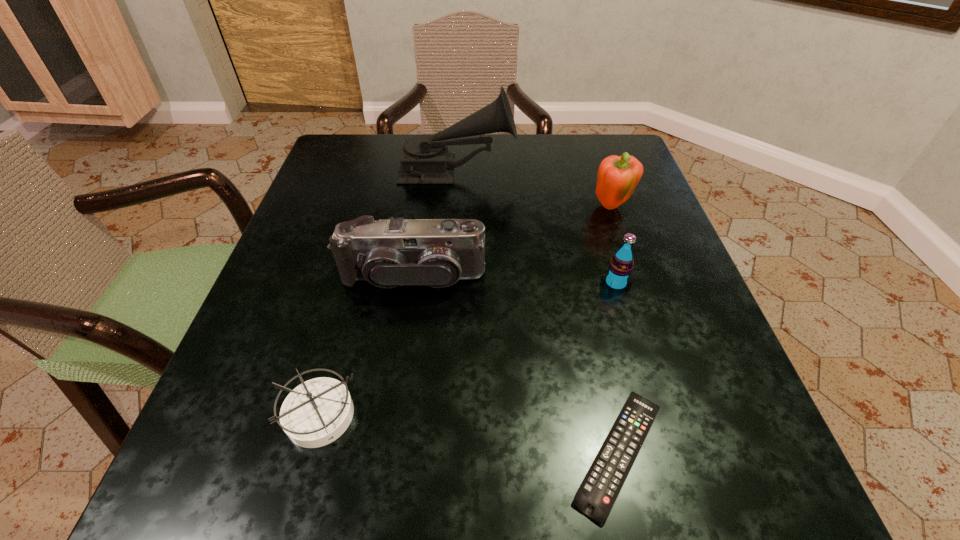
I want to click on empty space between the shortest object and the tallest object, so click(x=538, y=312).

The width and height of the screenshot is (960, 540). What are the coordinates of `unoccupied area between the pepper and the soda` in the screenshot? It's located at (613, 246).

Identify the location of free space between the second farthest object and the shortest object. (615, 330).

Find the location of a particular element. free spot between the pepper and the camcorder is located at coordinates (513, 243).

I want to click on free spot between the second shortest object and the remote control, so click(x=470, y=434).

The height and width of the screenshot is (540, 960). I want to click on free point between the tallest object and the remote control, so pos(538,312).

This screenshot has height=540, width=960. In order to click on unoccupied position between the soda and the farthest object in this screenshot , I will do `click(537, 227)`.

Where is `free space between the soda and the shortest object`? free space between the soda and the shortest object is located at coordinates (617, 368).

Identify which object is the third closest to the camcorder. Please provide its 2D coordinates. Your answer should be formatted as a tuple, i.e. [(x, y)], where the tuple contains the x and y coordinates of a point satisfying the conditions above.

[(596, 495)]

The width and height of the screenshot is (960, 540). Find the location of `the closest object to the compass`. the closest object to the compass is located at coordinates (389, 253).